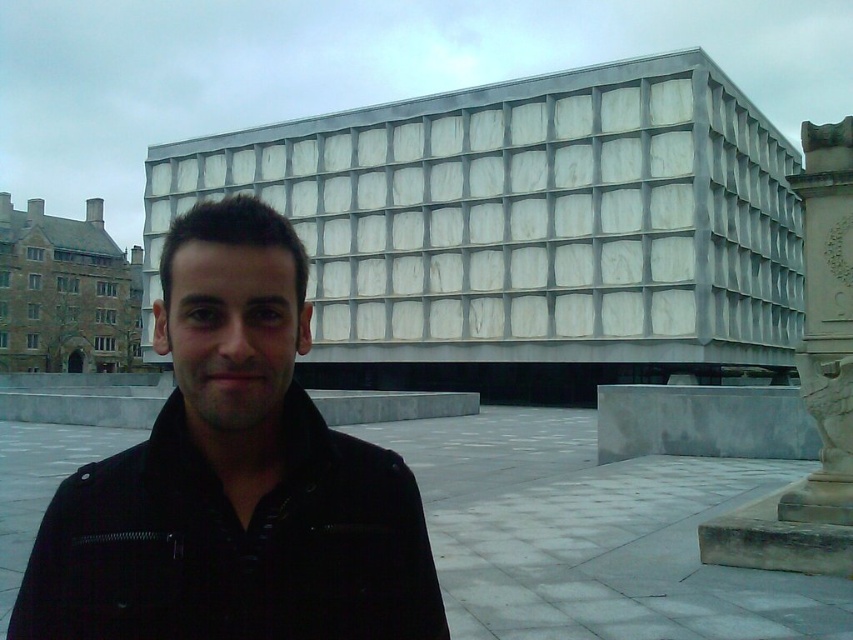
You are a photographer standing at the position of the person in the image. You want to take a photo that includes both the black leather jacket at center and the white stone column at right. What is the minimum distance you need to move backward to ensure both objects are in frame?

The black leather jacket at center is 22.20 meters from the white stone column at right. To include both in the frame, you need to move backward until you are at least 22.20 meters away from the closest object, ensuring both are within the camera view.

In the scene shown: You are an architect designing a new plaza. You need to place a statue exactly halfway between the black leather jacket at center and the white stone column at right. Which object will the statue be closer to?

The statue will be closer to the black leather jacket at center because it is smaller than the white stone column at right, so the midpoint between them would be nearer to the smaller object.